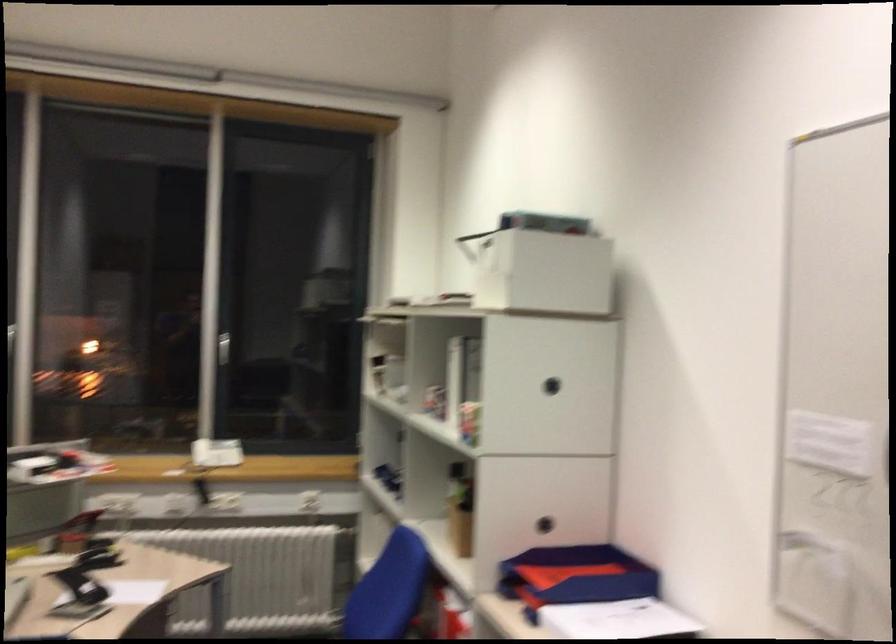
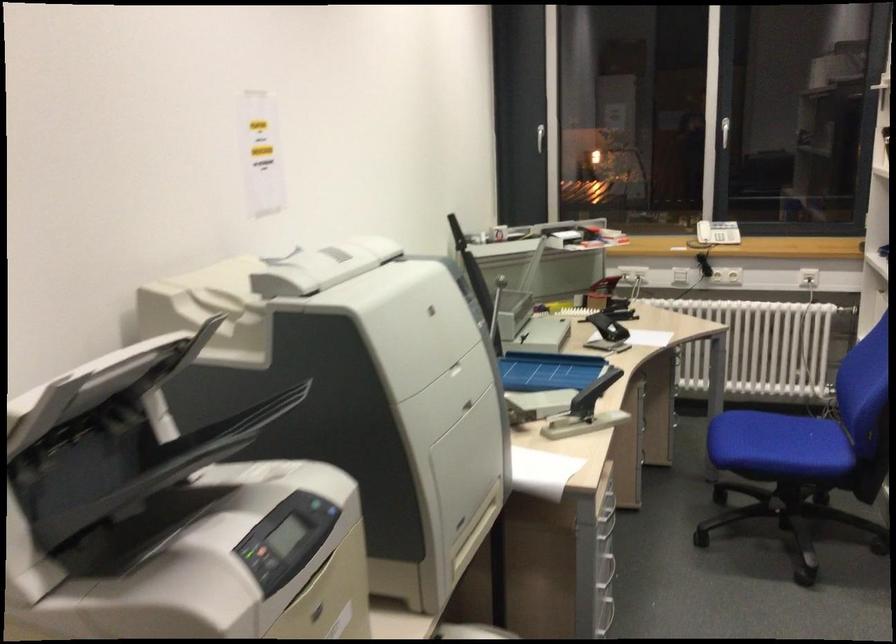
In the second image, find the point that corresponds to pixel 209 351 in the first image.

(721, 134)